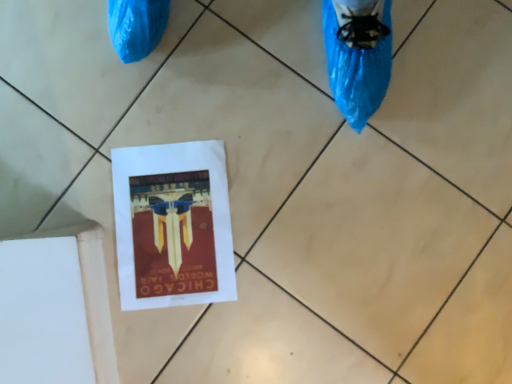
Question: From the image's perspective, relative to matte paper flyer at center, is white paper at center above or below?

Choices:
 (A) below
 (B) above

Answer: (A)

Question: Is point (415, 254) closer or farther from the camera than point (206, 147)?

Choices:
 (A) closer
 (B) farther

Answer: (A)

Question: Considering the positions of white paper at center and matte paper flyer at center in the image, is white paper at center wider or thinner than matte paper flyer at center?

Choices:
 (A) wide
 (B) thin

Answer: (B)

Question: Is matte paper flyer at center spatially inside white paper at center, or outside of it?

Choices:
 (A) inside
 (B) outside

Answer: (A)

Question: Considering the positions of matte paper flyer at center and white paper at center in the image, is matte paper flyer at center bigger or smaller than white paper at center?

Choices:
 (A) big
 (B) small

Answer: (B)

Question: Is point (159, 152) positioned closer to the camera than point (327, 198)?

Choices:
 (A) farther
 (B) closer

Answer: (A)

Question: Considering their positions, is matte paper flyer at center located in front of or behind white paper at center?

Choices:
 (A) front
 (B) behind

Answer: (B)